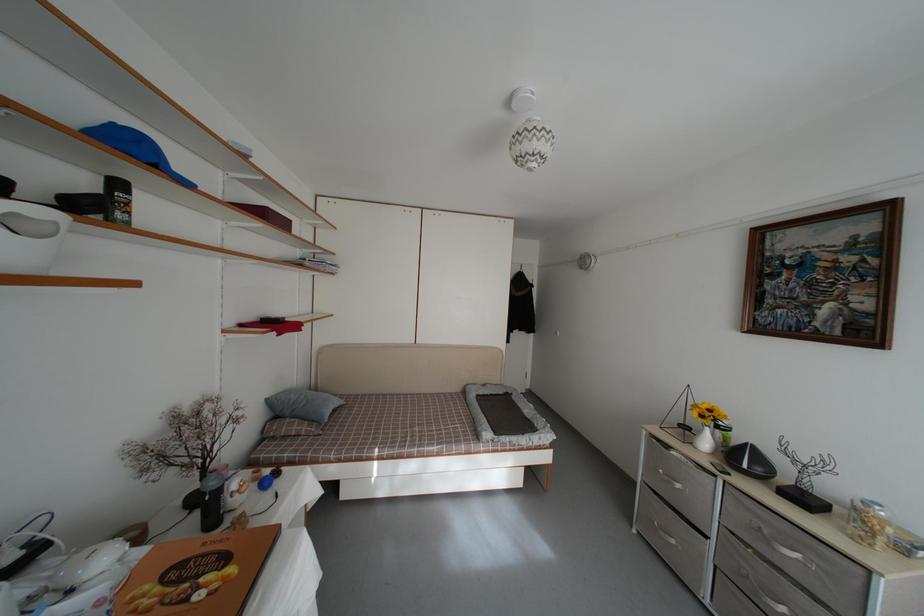
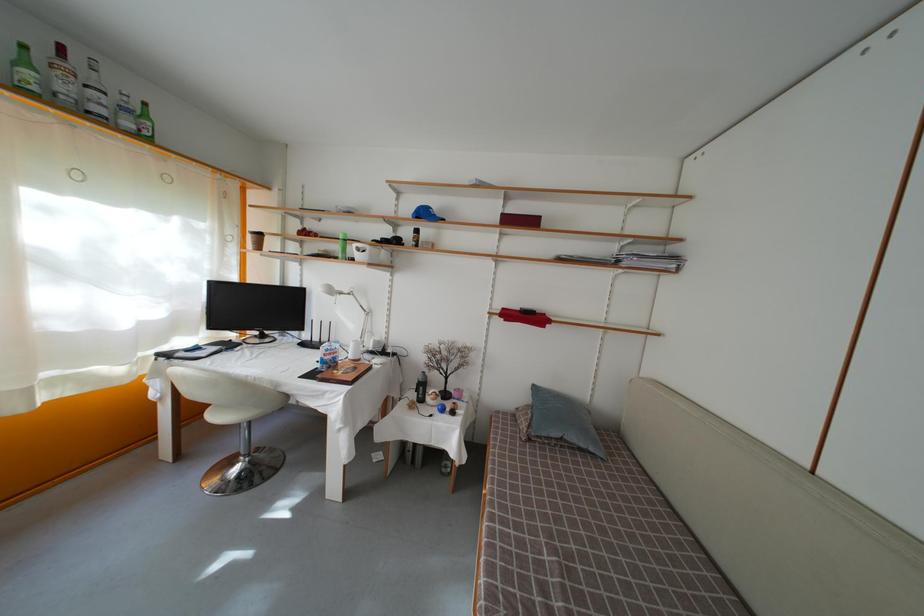
Locate, in the second image, the point that corresponds to pixel 332 431 in the first image.

(550, 450)